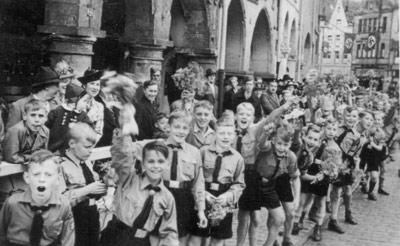
The width and height of the screenshot is (400, 246). In order to click on windows in this screenshot , I will do point(339,23), point(336,38), point(328,37).